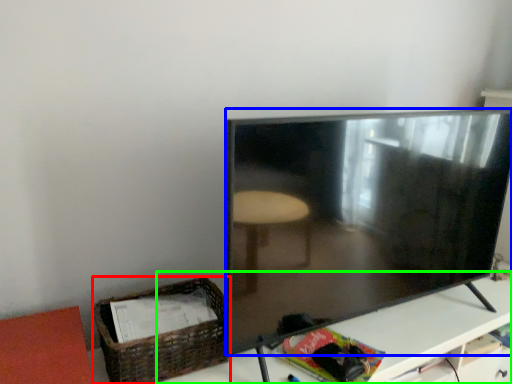
Question: Which object is positioned closest to basket (highlighted by a red box)? Select from television (highlighted by a blue box) and table (highlighted by a green box).

Choices:
 (A) television
 (B) table

Answer: (A)